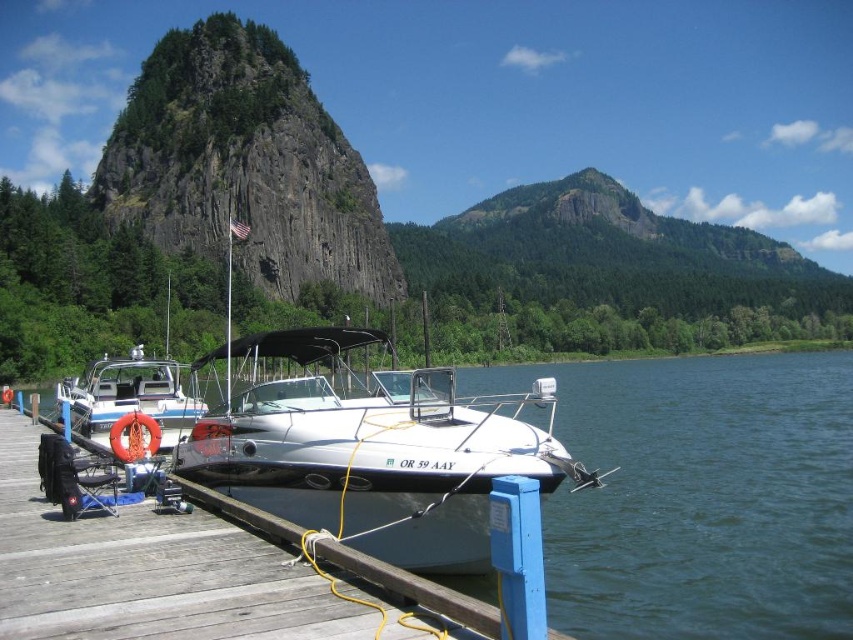
Between point (416, 554) and point (453, 593), which one is positioned in front?

Point (453, 593)

Can you confirm if white glossy boat at center is taller than wooden dock at lower left?

Yes.

Locate an element on the screen. Image resolution: width=853 pixels, height=640 pixels. white glossy boat at center is located at coordinates (378, 461).

Is point (357, 570) less distant than point (146, 404)?

That is True.

Is wooden dock at lower left to the right of white glossy boat at left from the viewer's perspective?

Correct, you'll find wooden dock at lower left to the right of white glossy boat at left.

Is point (281, 538) in front of point (186, 419)?

That is True.

This screenshot has height=640, width=853. In order to click on wooden dock at lower left in this screenshot , I will do `click(412, 588)`.

Which is in front, point (364, 333) or point (189, 401)?

Positioned in front is point (364, 333).

Does white glossy boat at center have a lesser height compared to white glossy boat at left?

No, white glossy boat at center is not shorter than white glossy boat at left.

Who is more forward, [456,433] or [183,369]?

Positioned in front is point [456,433].

Locate an element on the screen. white glossy boat at center is located at coordinates (378, 461).